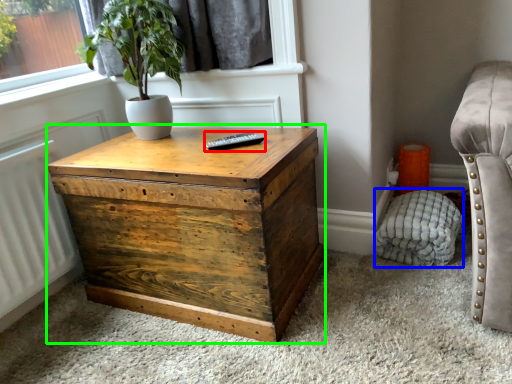
Question: Which object is positioned closest to remote (highlighted by a red box)? Select from swivel chair (highlighted by a blue box) and nightstand (highlighted by a green box).

Choices:
 (A) swivel chair
 (B) nightstand

Answer: (B)